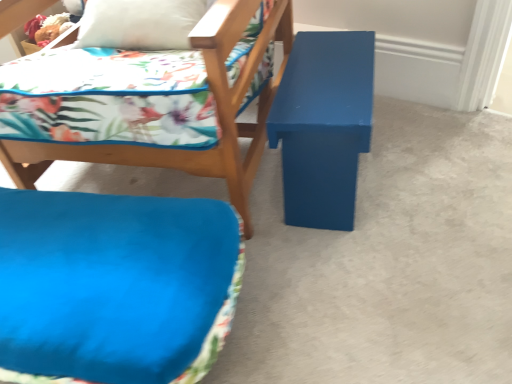
Question: Can you confirm if matte blue bench at right is wider than blue fabric cushion at lower left?

Choices:
 (A) no
 (B) yes

Answer: (B)

Question: Does matte blue bench at right have a greater height compared to blue fabric cushion at lower left?

Choices:
 (A) yes
 (B) no

Answer: (A)

Question: Does matte blue bench at right have a smaller size compared to blue fabric cushion at lower left?

Choices:
 (A) no
 (B) yes

Answer: (B)

Question: Considering the relative sizes of matte blue bench at right and blue fabric cushion at lower left in the image provided, is matte blue bench at right bigger than blue fabric cushion at lower left?

Choices:
 (A) no
 (B) yes

Answer: (A)

Question: From the image's perspective, does matte blue bench at right appear lower than blue fabric cushion at lower left?

Choices:
 (A) no
 (B) yes

Answer: (A)

Question: In terms of size, does matte blue bench at right appear bigger or smaller than blue fabric cushion at lower left?

Choices:
 (A) small
 (B) big

Answer: (A)

Question: Would you say matte blue bench at right is to the left or to the right of blue fabric cushion at lower left in the picture?

Choices:
 (A) right
 (B) left

Answer: (A)

Question: From the image's perspective, is matte blue bench at right located above or below blue fabric cushion at lower left?

Choices:
 (A) above
 (B) below

Answer: (A)

Question: Considering their positions, is matte blue bench at right located in front of or behind blue fabric cushion at lower left?

Choices:
 (A) front
 (B) behind

Answer: (B)

Question: Visually, is matte blue cushion at center positioned to the left or to the right of blue matte bench at center?

Choices:
 (A) left
 (B) right

Answer: (A)

Question: From a real-world perspective, relative to blue matte bench at center, is matte blue cushion at center vertically above or below?

Choices:
 (A) above
 (B) below

Answer: (A)

Question: From their relative heights in the image, would you say matte blue cushion at center is taller or shorter than blue matte bench at center?

Choices:
 (A) short
 (B) tall

Answer: (B)

Question: Relative to blue matte bench at center, is matte blue cushion at center in front or behind?

Choices:
 (A) front
 (B) behind

Answer: (B)

Question: Considering the positions of matte blue bench at right and blue matte bench at center in the image, is matte blue bench at right taller or shorter than blue matte bench at center?

Choices:
 (A) short
 (B) tall

Answer: (B)

Question: From the image's perspective, is matte blue bench at right positioned above or below blue matte bench at center?

Choices:
 (A) above
 (B) below

Answer: (A)